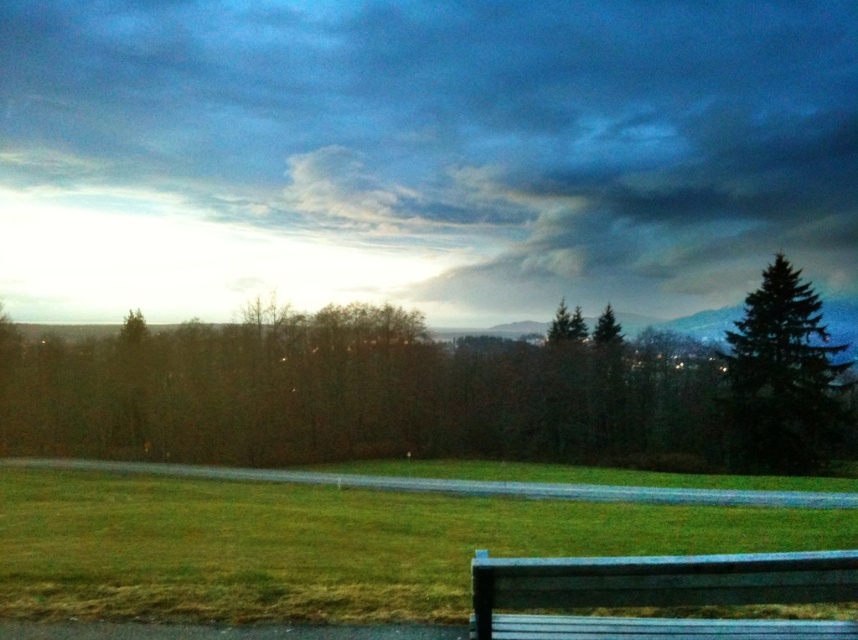
Question: Among these objects, which one is farthest from the camera?

Choices:
 (A) cloudy sky at upper center
 (B) green matte tree at right

Answer: (A)

Question: Is cloudy sky at upper center above green matte tree at center?

Choices:
 (A) no
 (B) yes

Answer: (B)

Question: Does green matte tree at center have a greater width compared to green grass at lower left?

Choices:
 (A) yes
 (B) no

Answer: (A)

Question: Considering the relative positions of green grass at lower left and green matte tree at right in the image provided, where is green grass at lower left located with respect to green matte tree at right?

Choices:
 (A) above
 (B) below

Answer: (B)

Question: Among these points, which one is nearest to the camera?

Choices:
 (A) (843, 564)
 (B) (597, 365)
 (C) (49, 554)
 (D) (325, 132)

Answer: (A)

Question: Which object appears farthest from the camera in this image?

Choices:
 (A) green grass at lower left
 (B) blue painted wood bench at lower right

Answer: (A)